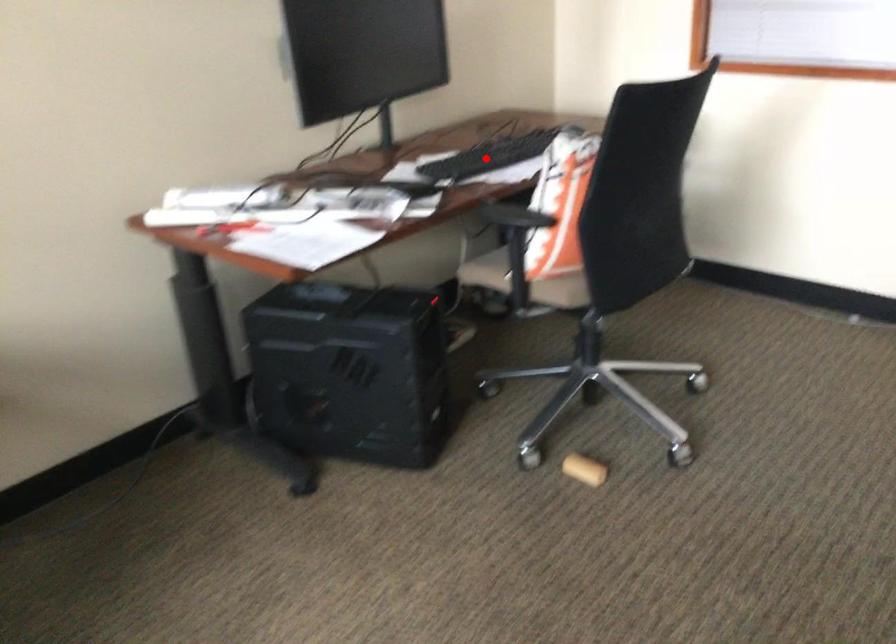
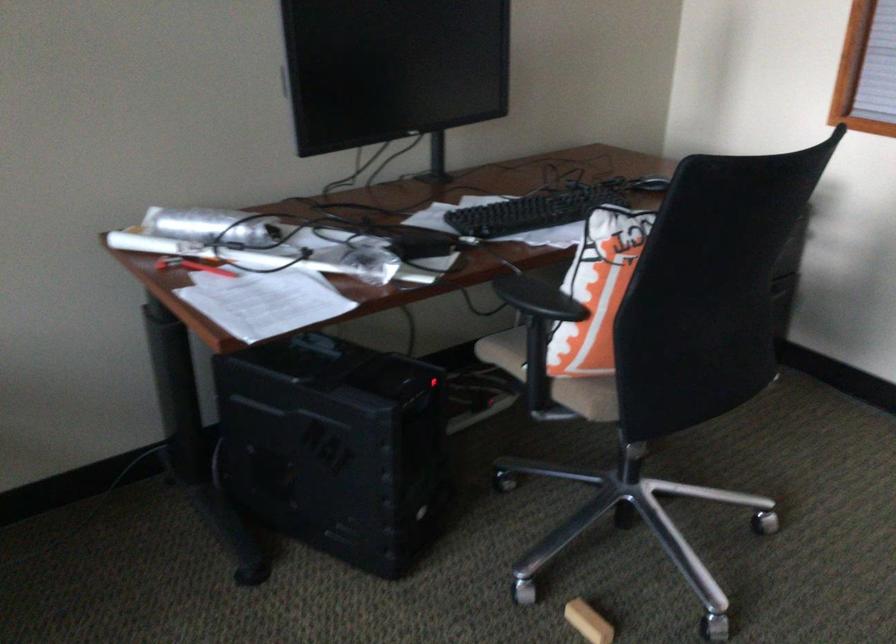
Question: I am providing you with two images of the same scene from different viewpoints. Given a red point in image1, look at the same physical point in image2. Is it:

Choices:
 (A) Closer to the viewpoint
 (B) Farther from the viewpoint

Answer: (A)